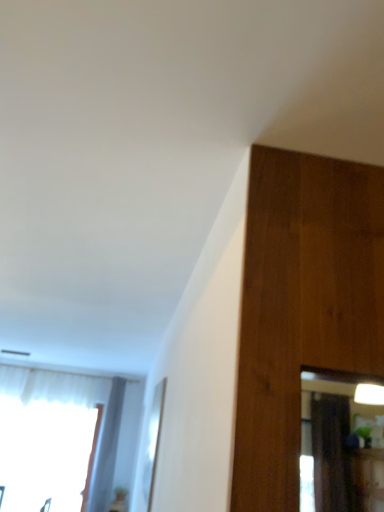
Locate an element on the screen. The width and height of the screenshot is (384, 512). white sheer curtain at lower left is located at coordinates (55, 438).

What do you see at coordinates (55, 438) in the screenshot?
I see `white sheer curtain at lower left` at bounding box center [55, 438].

You are a GUI agent. You are given a task and a screenshot of the screen. Output one action in this format:
    pyautogui.click(x=<x>, y=<y>)
    Task: Click on the white sheer curtain at lower left
    The image size is (384, 512).
    Given the screenshot: What is the action you would take?
    pyautogui.click(x=55, y=438)